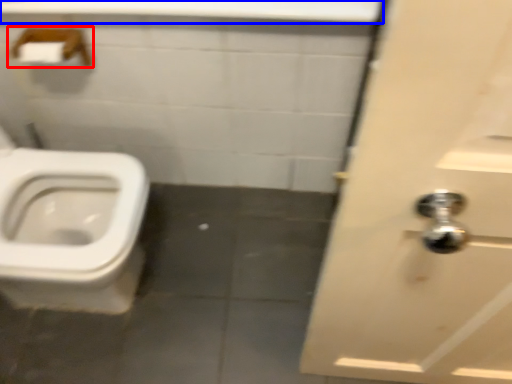
Question: Which object is closer to the camera taking this photo, towel bar (highlighted by a red box) or counter top (highlighted by a blue box)?

Choices:
 (A) towel bar
 (B) counter top

Answer: (B)